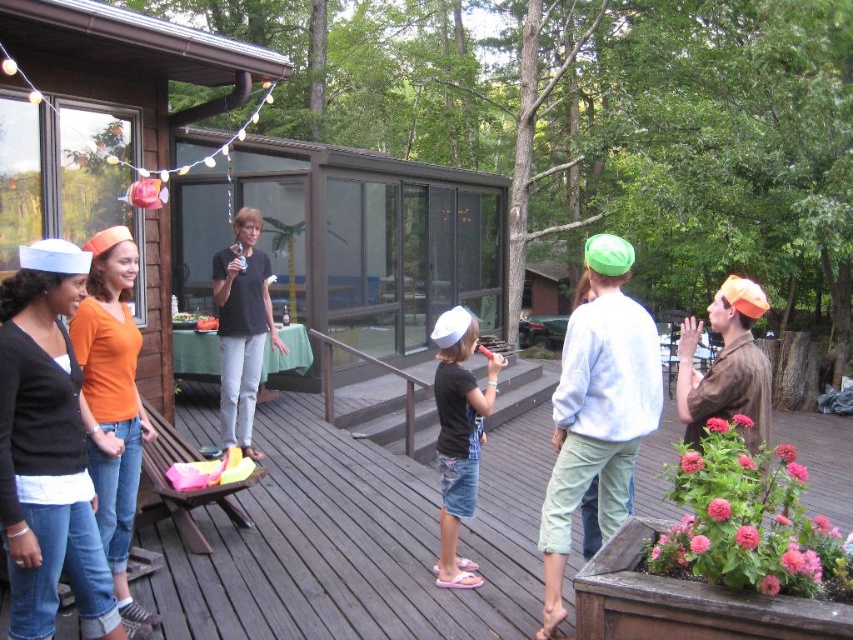
You are standing at the center of the deck and want to place a new decorative item exactly at the same position as the matte black cardigan at left. What are the coordinates where you should place it?

The coordinates for the matte black cardigan at left are at point (47, 451), so you should place the new decorative item at those coordinates.

You are standing at the origin point of the coordinate system. You want to walk to the wooden deck at center. What direction should you head in?

The wooden deck at center is located at coordinate point (357, 541), so you should head northeast to reach it.